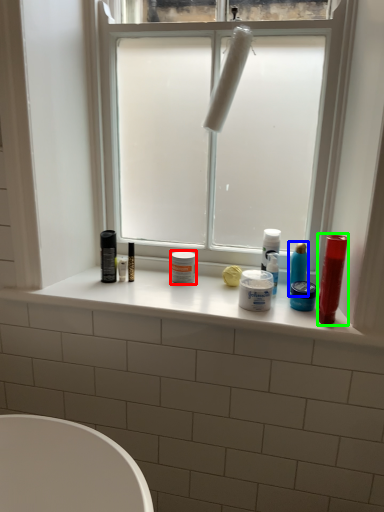
Question: Estimate the real-world distances between objects in this image. Which object is farther from toiletry (highlighted by a red box), toiletry (highlighted by a blue box) or lip balm (highlighted by a green box)?

Choices:
 (A) toiletry
 (B) lip balm

Answer: (B)